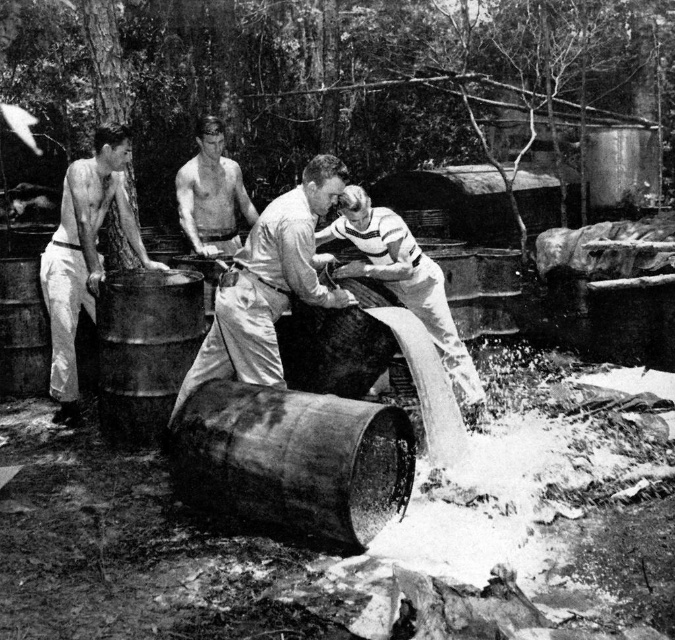
Can you confirm if rusty metallic barrel at center is thinner than smooth white shirt at left?

In fact, rusty metallic barrel at center might be wider than smooth white shirt at left.

Who is more distant from viewer, (396, 465) or (92, 321)?

Positioned behind is point (92, 321).

Locate an element on the screen. rusty metallic barrel at center is located at coordinates pyautogui.click(x=292, y=460).

Who is lower down, smooth leather jacket at center or smooth skin torso at center?

Positioned lower is smooth leather jacket at center.

What are the coordinates of `smooth leather jacket at center` in the screenshot? It's located at (405, 284).

Does smooth white shirt at left lie in front of smooth skin torso at center?

Yes, smooth white shirt at left is in front of smooth skin torso at center.

Between smooth white shirt at left and smooth skin torso at center, which one has more height?

smooth white shirt at left is taller.

What do you see at coordinates (82, 256) in the screenshot?
I see `smooth white shirt at left` at bounding box center [82, 256].

Find the location of a particular element. smooth white shirt at left is located at coordinates (82, 256).